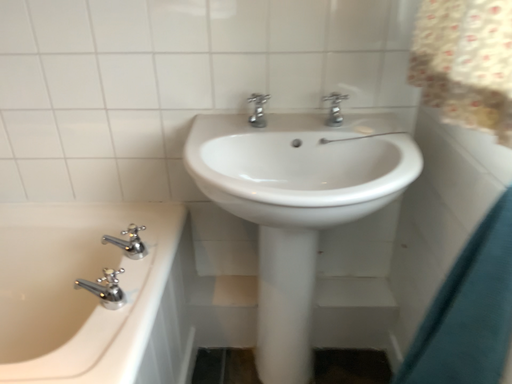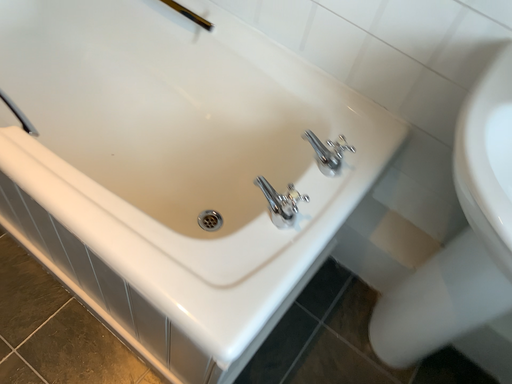
Question: How did the camera likely rotate when shooting the video?

Choices:
 (A) rotated left
 (B) rotated right

Answer: (A)